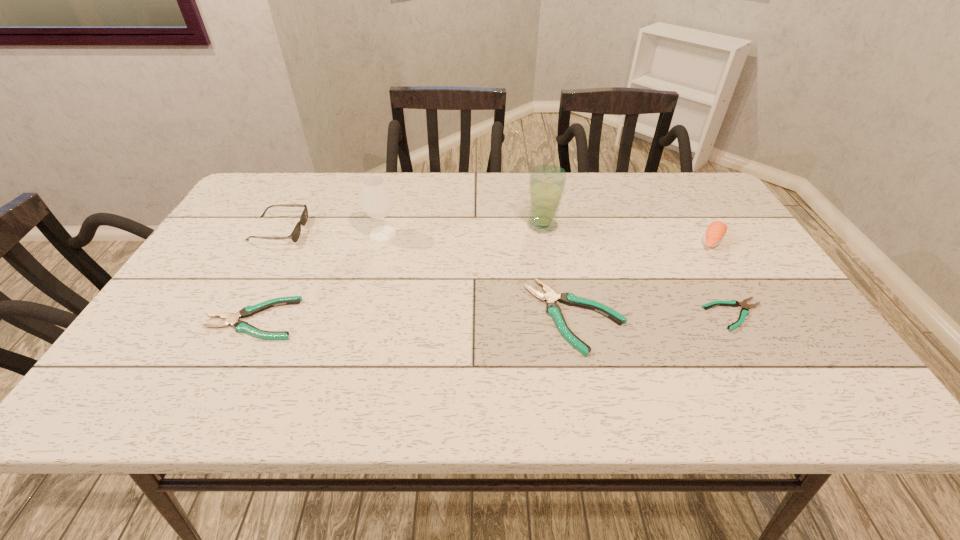
I want to click on free region located on the back of the second pliers from right to left, so tap(556, 221).

Where is `vacant space located on the front of the rightmost pliers`? The height and width of the screenshot is (540, 960). vacant space located on the front of the rightmost pliers is located at coordinates [x=756, y=350].

What are the coordinates of `vacant space located 0.380m on the right of the left glass` in the screenshot? It's located at (533, 234).

You are a GUI agent. You are given a task and a screenshot of the screen. Output one action in this format:
    pyautogui.click(x=<x>, y=<y>)
    Task: Click on the free space located 0.250m on the front-facing side of the fourth shortest object
    The height and width of the screenshot is (540, 960).
    Given the screenshot: What is the action you would take?
    pyautogui.click(x=393, y=231)

Identify the location of blank space located on the left of the fifth shortest object. (564, 241).

Identify the location of vacant space located 0.240m on the back of the right glass. This screenshot has width=960, height=540. (534, 174).

Locate an element on the screen. The height and width of the screenshot is (540, 960). object present at the far edge is located at coordinates (295, 234).

Where is `pliers present at the left edge`? The width and height of the screenshot is (960, 540). pliers present at the left edge is located at coordinates (232, 319).

Locate an element on the screen. The image size is (960, 540). sunglasses situated at the left edge is located at coordinates (295, 234).

Where is `pliers present at the right edge`? The height and width of the screenshot is (540, 960). pliers present at the right edge is located at coordinates (744, 312).